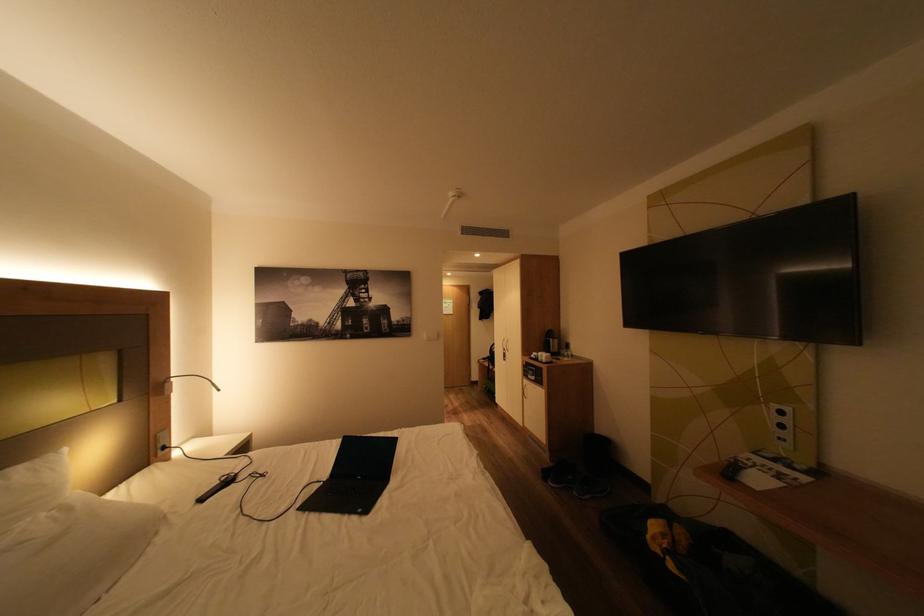
Find where to pull the silver wardrobe handle. Please return your answer as a coordinate pair (x, y).

(504, 349)